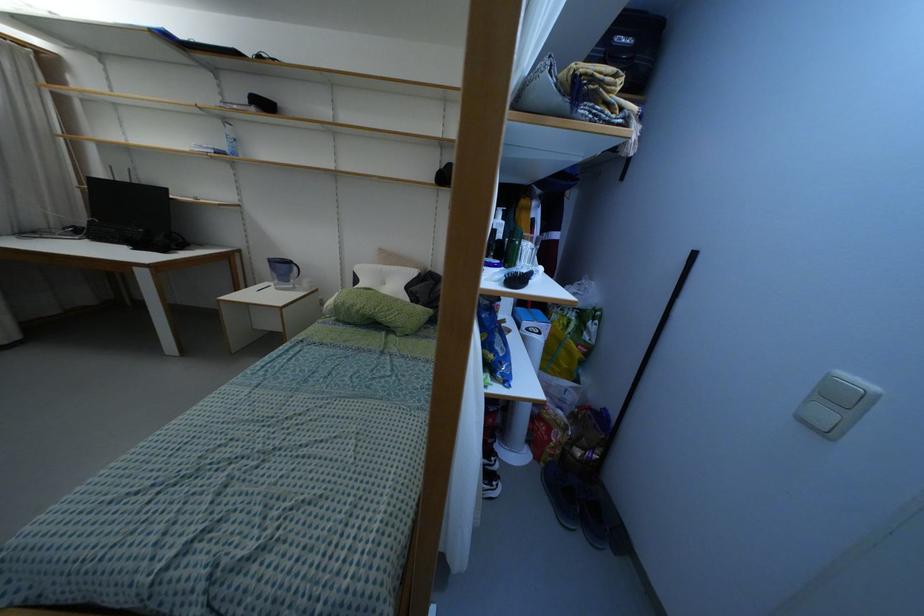
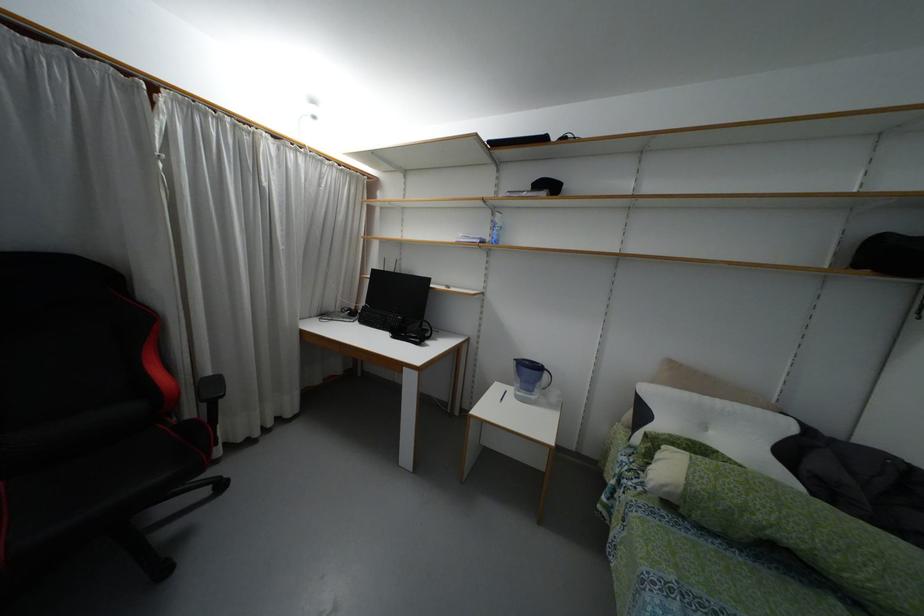
Locate, in the second image, the point that corresponds to [334,301] in the first image.

(687, 483)